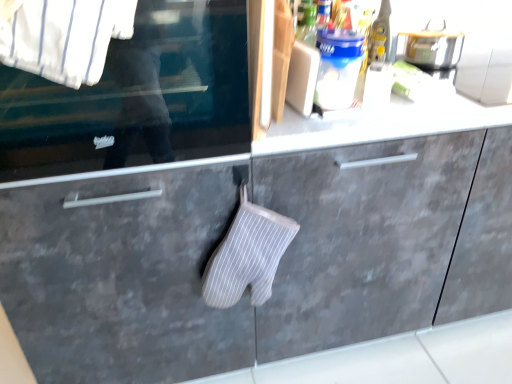
Describe the element at coordinates (122, 276) in the screenshot. The width and height of the screenshot is (512, 384). I see `gray matte drawer at lower left` at that location.

The height and width of the screenshot is (384, 512). Describe the element at coordinates (361, 239) in the screenshot. I see `white fabric oven mitt at center` at that location.

What do you see at coordinates (247, 255) in the screenshot? The image size is (512, 384). I see `white striped fabric oven mitt at center` at bounding box center [247, 255].

The width and height of the screenshot is (512, 384). I want to click on gray matte drawer at lower left, so click(122, 276).

Is white striped fabric oven mitt at center not inside white striped fabric at upper left?

Yes, white striped fabric oven mitt at center is located beyond the bounds of white striped fabric at upper left.

Which of these two, white striped fabric oven mitt at center or white striped fabric at upper left, is thinner?

white striped fabric oven mitt at center.

Locate an element on the screen. The height and width of the screenshot is (384, 512). wide that is below the white striped fabric at upper left (from the image's perspective) is located at coordinates (247, 255).

Considering the positions of objects transparent glass window at center and white striped fabric oven mitt at center in the image provided, who is in front, transparent glass window at center or white striped fabric oven mitt at center?

transparent glass window at center is more forward.

Does point (102, 165) lie behind point (222, 242)?

No, (102, 165) is in front of (222, 242).

Locate an element on the screen. This screenshot has width=512, height=384. wide behind the transparent glass window at center is located at coordinates (247, 255).

Considering the relative positions of gray matte drawer at lower left and metallic silver toaster at upper right in the image provided, is gray matte drawer at lower left behind metallic silver toaster at upper right?

No, the depth of gray matte drawer at lower left is less than that of metallic silver toaster at upper right.

Is gray matte drawer at lower left next to metallic silver toaster at upper right?

gray matte drawer at lower left and metallic silver toaster at upper right are clearly separated.

Who is bigger, gray matte drawer at lower left or metallic silver toaster at upper right?

gray matte drawer at lower left is bigger.

Looking at this image, can metallic silver toaster at upper right be found inside gray matte drawer at lower left?

No, metallic silver toaster at upper right is located outside of gray matte drawer at lower left.

Considering the relative sizes of white fabric oven mitt at center and white striped fabric at upper left in the image provided, is white fabric oven mitt at center shorter than white striped fabric at upper left?

In fact, white fabric oven mitt at center may be taller than white striped fabric at upper left.

From the image's perspective, is white fabric oven mitt at center located beneath white striped fabric at upper left?

Yes, from the image's perspective, white fabric oven mitt at center is below white striped fabric at upper left.

Which of these two, white fabric oven mitt at center or white striped fabric at upper left, is smaller?

With smaller size is white striped fabric at upper left.

Which object is positioned more to the right, white fabric oven mitt at center or metallic silver toaster at upper right?

metallic silver toaster at upper right is more to the right.

Is point (285, 337) less distant than point (426, 61)?

That is True.

Is metallic silver toaster at upper right at the back of white fabric oven mitt at center?

No, white fabric oven mitt at center is not facing the opposite direction of metallic silver toaster at upper right.

The height and width of the screenshot is (384, 512). What are the coordinates of `appliance above the white striped fabric oven mitt at center (from a real-world perspective)` in the screenshot? It's located at (434, 47).

Would you say metallic silver toaster at upper right is outside white striped fabric oven mitt at center?

metallic silver toaster at upper right is positioned outside white striped fabric oven mitt at center.

Considering the positions of objects metallic silver toaster at upper right and white striped fabric oven mitt at center in the image provided, who is in front, metallic silver toaster at upper right or white striped fabric oven mitt at center?

white striped fabric oven mitt at center is in front.

Consider the image. Which is closer to the camera, (431, 51) or (239, 210)?

Clearly, point (431, 51) is more distant from the camera than point (239, 210).

Which is in front, transparent glass window at center or metallic silver toaster at upper right?

transparent glass window at center is in front.

You are a GUI agent. You are given a task and a screenshot of the screen. Output one action in this format:
    pyautogui.click(x=<x>, y=<y>)
    Task: Click on the appliance located underneath the transparent glass window at center (from a real-world perspective)
    Image resolution: width=512 pixels, height=384 pixels.
    Given the screenshot: What is the action you would take?
    click(434, 47)

Looking at this image, is transparent glass window at center oriented towards metallic silver toaster at upper right?

No, transparent glass window at center is not facing towards metallic silver toaster at upper right.

Can you confirm if transparent glass window at center is thinner than metallic silver toaster at upper right?

No.

The image size is (512, 384). Identify the location of shirt in front of the white striped fabric oven mitt at center. (63, 36).

Locate an element on the screen. This screenshot has width=512, height=384. wide lying below the transparent glass window at center (from the image's perspective) is located at coordinates (247, 255).

Looking at the image, which one is located closer to gray matte drawer at lower left, white fabric oven mitt at center or white striped fabric at upper left?

white fabric oven mitt at center is positioned closer to the anchor gray matte drawer at lower left.

When comparing their distances from gray matte drawer at lower left, does metallic silver toaster at upper right or white striped fabric oven mitt at center seem further?

metallic silver toaster at upper right.

From the image, which object appears to be nearer to gray matte drawer at lower left, white striped fabric oven mitt at center or white striped fabric at upper left?

white striped fabric oven mitt at center is closer to gray matte drawer at lower left.

Looking at the image, which one is located closer to metallic silver toaster at upper right, transparent glass window at center or gray matte drawer at lower left?

The object closer to metallic silver toaster at upper right is transparent glass window at center.

Which object lies nearer to the anchor point white striped fabric oven mitt at center, metallic silver toaster at upper right or transparent glass window at center?

transparent glass window at center is positioned closer to the anchor white striped fabric oven mitt at center.

Estimate the real-world distances between objects in this image. Which object is further from gray matte drawer at lower left, white fabric oven mitt at center or transparent glass window at center?

The object further to gray matte drawer at lower left is white fabric oven mitt at center.

Estimate the real-world distances between objects in this image. Which object is further from transparent glass window at center, white striped fabric at upper left or white striped fabric oven mitt at center?

white striped fabric oven mitt at center.

Looking at the image, which one is located further to metallic silver toaster at upper right, white striped fabric oven mitt at center or white fabric oven mitt at center?

Based on the image, white striped fabric oven mitt at center appears to be further to metallic silver toaster at upper right.

Where is `drawer that lies between transparent glass window at center and white striped fabric oven mitt at center from top to bottom`? Image resolution: width=512 pixels, height=384 pixels. drawer that lies between transparent glass window at center and white striped fabric oven mitt at center from top to bottom is located at coordinates (122, 276).

Image resolution: width=512 pixels, height=384 pixels. Identify the location of wide between gray matte drawer at lower left and metallic silver toaster at upper right. (247, 255).

This screenshot has width=512, height=384. What are the coordinates of `wide situated between white striped fabric at upper left and metallic silver toaster at upper right from left to right` in the screenshot? It's located at (247, 255).

This screenshot has width=512, height=384. Identify the location of wide between white striped fabric at upper left and white fabric oven mitt at center in the horizontal direction. click(x=247, y=255).